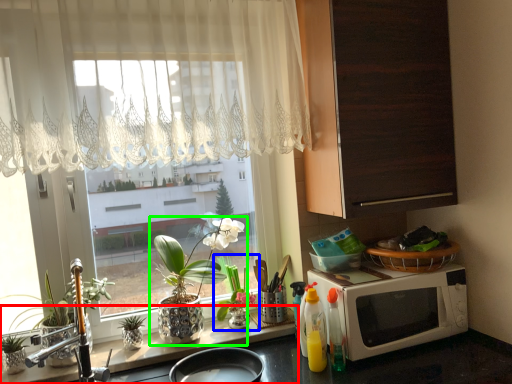
Question: Based on their relative distances, which object is nearer to counter top (highlighted by a red box)? Choose from houseplant (highlighted by a blue box) and houseplant (highlighted by a green box).

Choices:
 (A) houseplant
 (B) houseplant

Answer: (B)